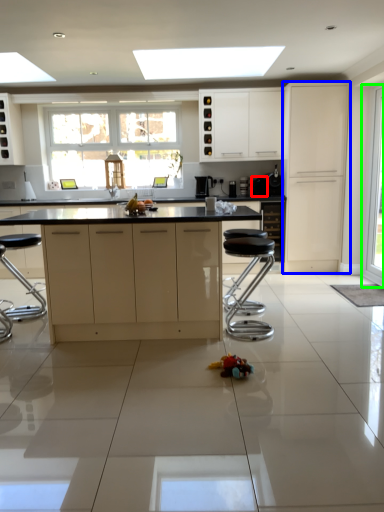
Question: Which object is the closest to the appliance (highlighted by a red box)? Choose among these: cabinetry (highlighted by a blue box) or glass door (highlighted by a green box).

Choices:
 (A) cabinetry
 (B) glass door

Answer: (A)